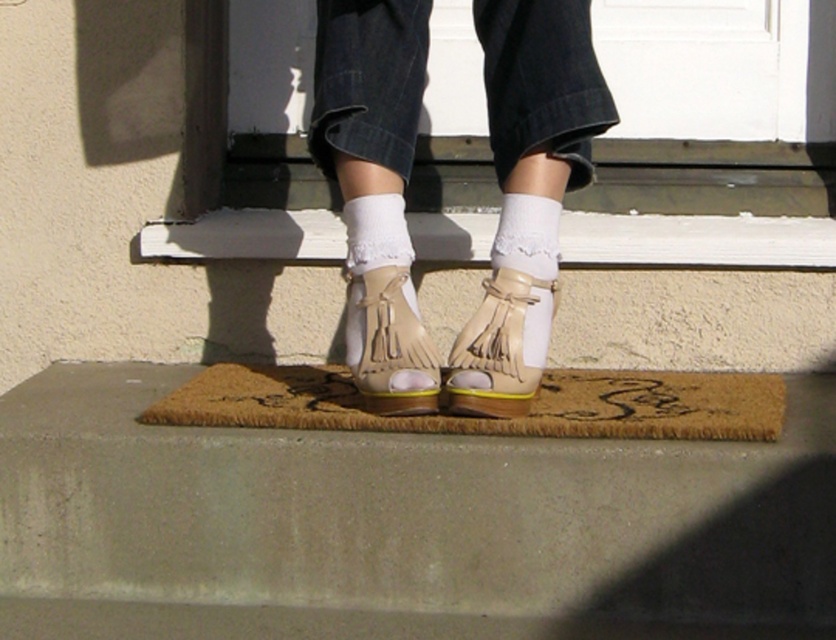
Question: Which point is farther to the camera?

Choices:
 (A) (498, 259)
 (B) (516, 356)
 (C) (508, 275)

Answer: (A)

Question: Which is farther from the brown coir mat at center?

Choices:
 (A) beige suede sandals at center
 (B) white lace sock at center

Answer: (B)

Question: Is beige suede fringe sandal at center bigger than leather fringe sandals at center?

Choices:
 (A) no
 (B) yes

Answer: (B)

Question: Among these points, which one is farthest from the camera?

Choices:
 (A) (510, 276)
 (B) (538, 224)
 (C) (543, 125)
 (D) (396, 310)

Answer: (B)

Question: Is beige suede sandals at center further to camera compared to white lace sock at center?

Choices:
 (A) yes
 (B) no

Answer: (B)

Question: Can you confirm if brown coir mat at center is positioned to the left of white lace sock at center?

Choices:
 (A) yes
 (B) no

Answer: (A)